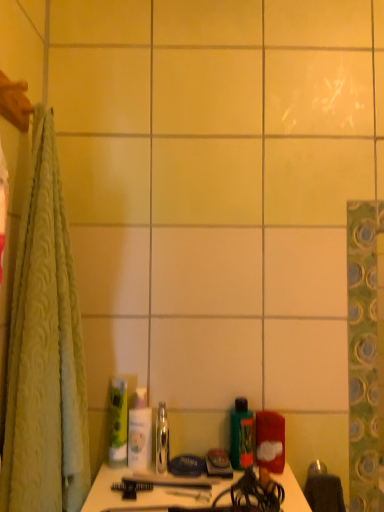
Question: Is green matte bottle at center, which is the second mouthwash from left to right, facing towards green matte tube at center, the first toiletry when ordered from left to right?

Choices:
 (A) yes
 (B) no

Answer: (B)

Question: Is green matte bottle at center, arranged as the first mouthwash when viewed from the right, wider than green matte tube at center, the 3th toiletry viewed from the right?

Choices:
 (A) no
 (B) yes

Answer: (B)

Question: Is green matte bottle at center, which is the second mouthwash from left to right, placed right next to green matte tube at center, the 3th toiletry viewed from the right?

Choices:
 (A) yes
 (B) no

Answer: (B)

Question: Is green matte tube at center, the 3th toiletry viewed from the right, surrounded by green matte bottle at center, arranged as the first mouthwash when viewed from the right?

Choices:
 (A) no
 (B) yes

Answer: (A)

Question: Is green matte bottle at center, which is the second mouthwash from left to right, outside of green matte tube at center, the first toiletry when ordered from left to right?

Choices:
 (A) yes
 (B) no

Answer: (A)

Question: Is green matte bottle at center, which is the second mouthwash from left to right, further to camera compared to green matte tube at center, the 3th toiletry viewed from the right?

Choices:
 (A) no
 (B) yes

Answer: (A)

Question: Is green matte tube at center, the first toiletry when ordered from left to right, outside clear plastic mouthwash at center, arranged as the 2th mouthwash when viewed from the right?

Choices:
 (A) no
 (B) yes

Answer: (B)

Question: Is green matte tube at center, the 3th toiletry viewed from the right, shorter than clear plastic mouthwash at center, placed as the first mouthwash when sorted from left to right?

Choices:
 (A) yes
 (B) no

Answer: (B)

Question: Does green matte tube at center, the 3th toiletry viewed from the right, have a greater height compared to clear plastic mouthwash at center, placed as the first mouthwash when sorted from left to right?

Choices:
 (A) yes
 (B) no

Answer: (A)

Question: Is green matte tube at center, the 3th toiletry viewed from the right, wider than clear plastic mouthwash at center, placed as the first mouthwash when sorted from left to right?

Choices:
 (A) no
 (B) yes

Answer: (A)

Question: From a real-world perspective, is green matte tube at center, the first toiletry when ordered from left to right, on top of clear plastic mouthwash at center, placed as the first mouthwash when sorted from left to right?

Choices:
 (A) yes
 (B) no

Answer: (A)

Question: Is green matte tube at center, the first toiletry when ordered from left to right, positioned far away from clear plastic mouthwash at center, arranged as the 2th mouthwash when viewed from the right?

Choices:
 (A) yes
 (B) no

Answer: (B)

Question: Can you confirm if green matte bottle at center, which is the second mouthwash from left to right, is taller than matte red container at lower right, which is the third toiletry in left-to-right order?

Choices:
 (A) yes
 (B) no

Answer: (A)